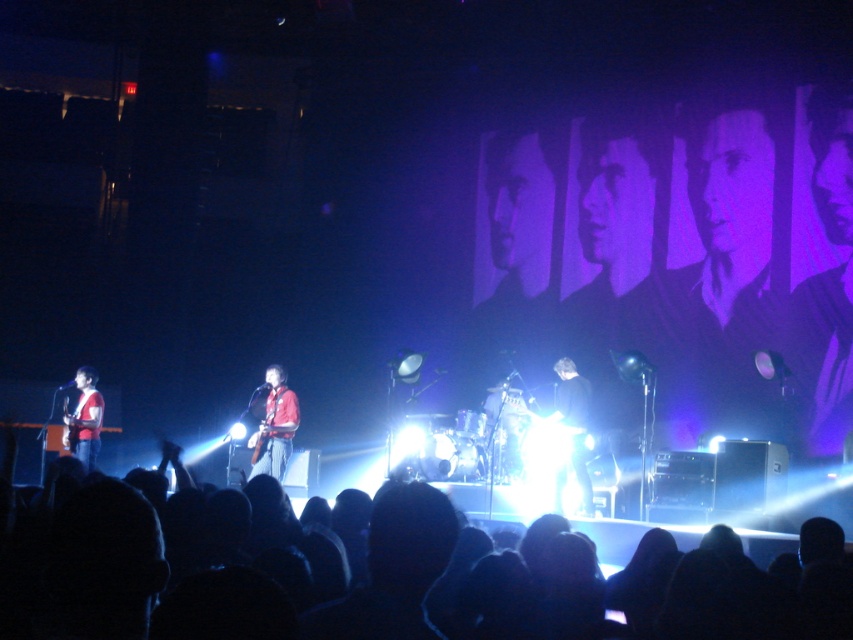
Question: Which object appears farthest from the camera in this image?

Choices:
 (A) black fabric crowd at lower center
 (B) red fabric guitar at center
 (C) matte red shirt at left

Answer: (C)

Question: From the image, what is the correct spatial relationship of red fabric guitar at center in relation to matte red shirt at left?

Choices:
 (A) right
 (B) left

Answer: (A)

Question: Is red fabric guitar at center bigger than matte red shirt at left?

Choices:
 (A) yes
 (B) no

Answer: (B)

Question: Which of the following is the closest to the observer?

Choices:
 (A) matte red shirt at left
 (B) black fabric crowd at lower center

Answer: (B)

Question: Which point appears closest to the camera in this image?

Choices:
 (A) (271, 387)
 (B) (97, 401)

Answer: (A)

Question: Can you confirm if black fabric crowd at lower center is positioned below red fabric guitar at center?

Choices:
 (A) yes
 (B) no

Answer: (A)